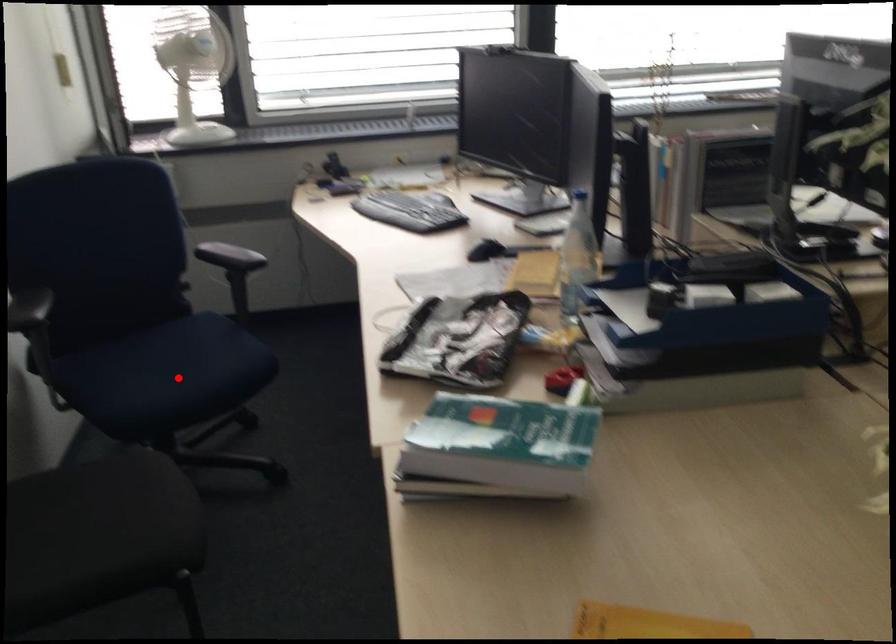
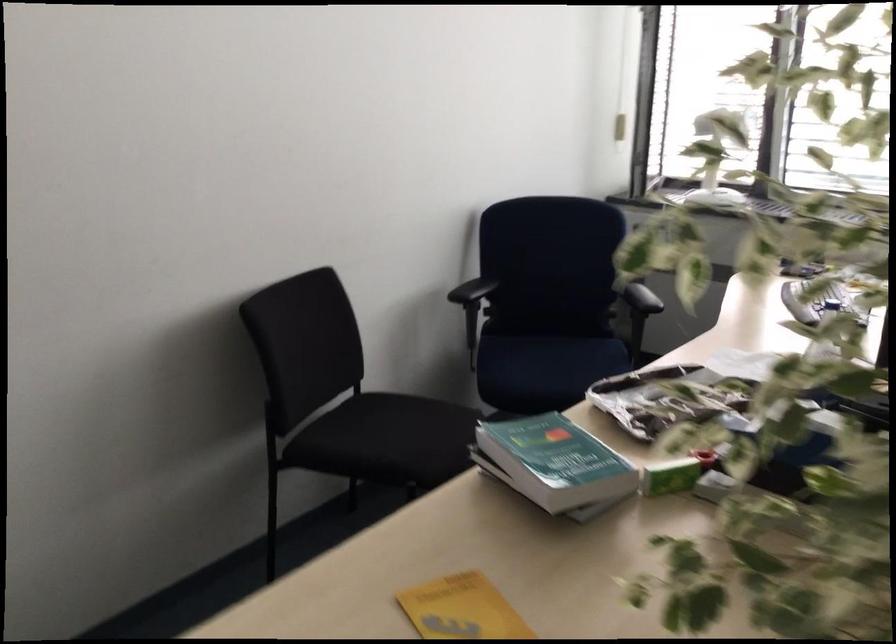
Locate, in the second image, the point that corresponds to the highlighted location in the first image.

(547, 366)